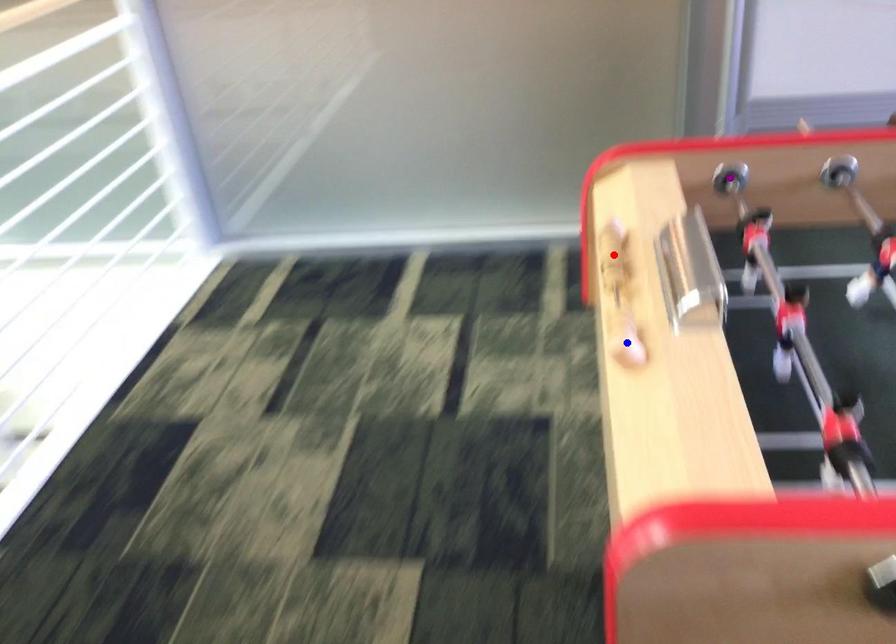
Order these from farthest to nearest:
purple point | blue point | red point

purple point < red point < blue point